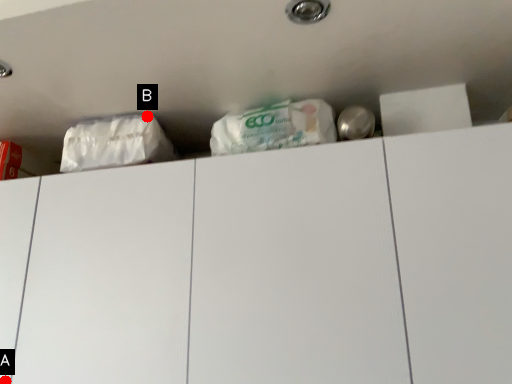
Question: Two points are circled on the image, labeled by A and B beside each circle. Which point is farther to the camera?

Choices:
 (A) A is further
 (B) B is further

Answer: (B)